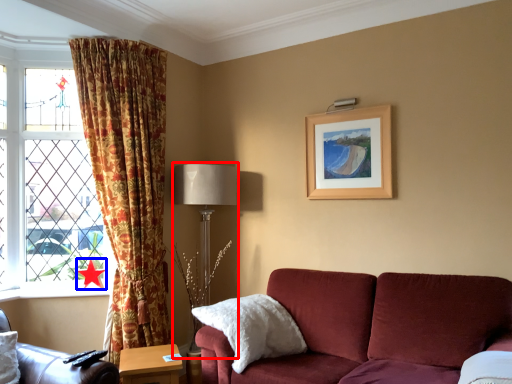
Question: Which of the following is the closest to the observer, table lamp (highlighted by a red box) or star (highlighted by a blue box)?

Choices:
 (A) table lamp
 (B) star

Answer: (A)